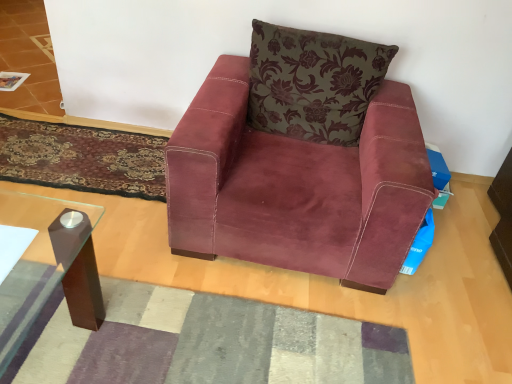
Question: From a real-world perspective, is velvet-like burgundy mat at lower left, which appears as the second mat when viewed from the front, physically located above or below velvet floral pillow at center?

Choices:
 (A) above
 (B) below

Answer: (B)

Question: Considering the positions of velvet-like burgundy mat at lower left, placed as the 1th mat when sorted from top to bottom, and velvet floral pillow at center in the image, is velvet-like burgundy mat at lower left, placed as the 1th mat when sorted from top to bottom, wider or thinner than velvet floral pillow at center?

Choices:
 (A) thin
 (B) wide

Answer: (B)

Question: Which object is the farthest from the suede-like burgundy armchair at center?

Choices:
 (A) velvet-like burgundy mat at lower left, which ranks as the second mat in bottom-to-top order
 (B) velvet floral pillow at center
 (C) textured gray mat at center, which appears as the 1th mat when viewed from the front

Answer: (A)

Question: Which object is positioned closest to the velvet-like burgundy mat at lower left, the 1th mat in the back-to-front sequence?

Choices:
 (A) velvet floral pillow at center
 (B) textured gray mat at center, which appears as the 1th mat when viewed from the front
 (C) suede-like burgundy armchair at center

Answer: (C)